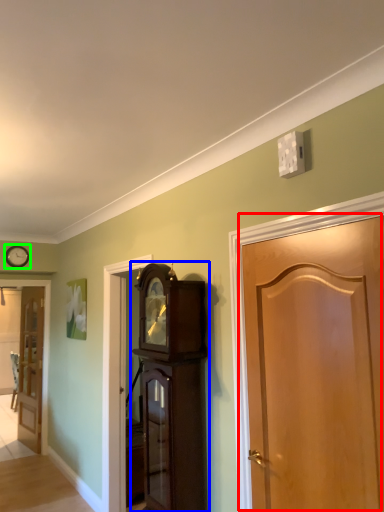
Question: Which is farther away from door (highlighted by a red box)? cabinetry (highlighted by a blue box) or clock (highlighted by a green box)?

Choices:
 (A) cabinetry
 (B) clock

Answer: (B)